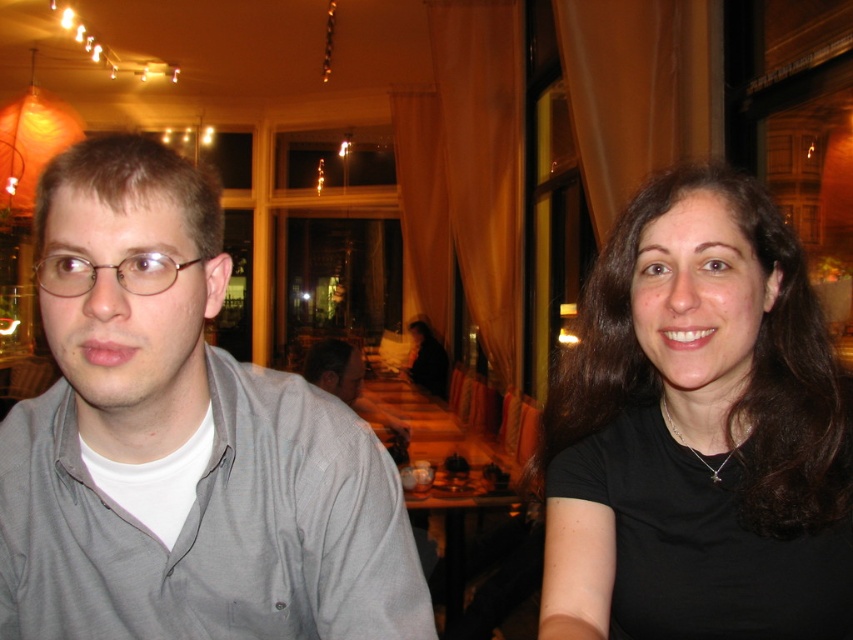
What do you see at coordinates (184, 449) in the screenshot?
I see `gray cotton shirt at left` at bounding box center [184, 449].

Measure the distance between gray cotton shirt at left and wooden table at center.

A distance of 2.30 meters exists between gray cotton shirt at left and wooden table at center.

The width and height of the screenshot is (853, 640). What do you see at coordinates (184, 449) in the screenshot?
I see `gray cotton shirt at left` at bounding box center [184, 449].

You are a GUI agent. You are given a task and a screenshot of the screen. Output one action in this format:
    pyautogui.click(x=<x>, y=<y>)
    Task: Click on the gray cotton shirt at left
    The image size is (853, 640).
    Given the screenshot: What is the action you would take?
    pyautogui.click(x=184, y=449)

Does black matte hair at upper right appear under light gray shirt at center?

No.

Can you confirm if black matte hair at upper right is positioned to the left of light gray shirt at center?

No, black matte hair at upper right is not to the left of light gray shirt at center.

The height and width of the screenshot is (640, 853). What are the coordinates of `black matte hair at upper right` in the screenshot? It's located at (698, 432).

Find the location of a particular element. This screenshot has width=853, height=640. black matte hair at upper right is located at coordinates (698, 432).

Who is more distant from viewer, (451, 522) or (144, 285)?

Point (451, 522)

In the scene shown: Which is more to the right, wooden table at center or matte plastic glasses at left?

Positioned to the right is wooden table at center.

Between point (537, 529) and point (39, 282), which one is positioned behind?

The point (537, 529) is behind.

Where is `wooden table at center`? The height and width of the screenshot is (640, 853). wooden table at center is located at coordinates (502, 589).